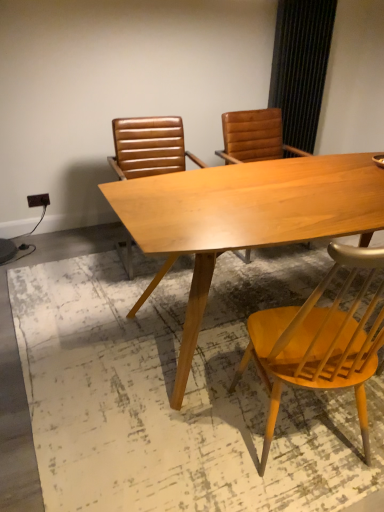
Question: Does light wood chair at lower right, which is the 1th chair in right-to-left order, appear on the left side of light wood table at center?

Choices:
 (A) no
 (B) yes

Answer: (B)

Question: Is light wood table at center a part of light wood chair at lower right, which appears as the second chair when viewed from the left?

Choices:
 (A) no
 (B) yes

Answer: (A)

Question: From a real-world perspective, is light wood chair at lower right, the first chair when ordered from front to back, over light wood table at center?

Choices:
 (A) no
 (B) yes

Answer: (B)

Question: Is the position of light wood chair at lower right, which appears as the second chair when viewed from the left, less distant than that of light wood table at center?

Choices:
 (A) yes
 (B) no

Answer: (A)

Question: Is light wood chair at lower right, the first chair when ordered from front to back, bigger than light wood table at center?

Choices:
 (A) no
 (B) yes

Answer: (A)

Question: Which is correct: light wood chair at lower right, the first chair when ordered from front to back, is inside light wood table at center, or outside of it?

Choices:
 (A) outside
 (B) inside

Answer: (A)

Question: Considering the positions of point (297, 315) and point (370, 158), is point (297, 315) closer or farther from the camera than point (370, 158)?

Choices:
 (A) closer
 (B) farther

Answer: (A)

Question: Looking at their shapes, would you say light wood chair at lower right, marked as the second chair in a back-to-front arrangement, is wider or thinner than light wood table at center?

Choices:
 (A) wide
 (B) thin

Answer: (B)

Question: In the image, is light wood chair at lower right, which appears as the second chair when viewed from the left, positioned in front of or behind light wood table at center?

Choices:
 (A) front
 (B) behind

Answer: (A)

Question: Relative to leather-like brown chair at center, which ranks as the first chair in back-to-front order, is light wood table at center in front or behind?

Choices:
 (A) behind
 (B) front

Answer: (B)

Question: Is light wood table at center inside the boundaries of leather-like brown chair at center, which ranks as the first chair in back-to-front order, or outside?

Choices:
 (A) outside
 (B) inside

Answer: (A)

Question: Looking at the image, does light wood table at center seem bigger or smaller compared to leather-like brown chair at center, which ranks as the 2th chair in front-to-back order?

Choices:
 (A) small
 (B) big

Answer: (B)

Question: Based on their positions, is light wood table at center located to the left or right of leather-like brown chair at center, which ranks as the first chair in back-to-front order?

Choices:
 (A) left
 (B) right

Answer: (B)

Question: Looking at the image, does light wood chair at lower right, which appears as the second chair when viewed from the left, seem bigger or smaller compared to leather-like brown chair at center, which is the second chair from right to left?

Choices:
 (A) big
 (B) small

Answer: (B)

Question: From the image's perspective, is light wood chair at lower right, the first chair when ordered from front to back, positioned above or below leather-like brown chair at center, which ranks as the first chair in back-to-front order?

Choices:
 (A) below
 (B) above

Answer: (A)